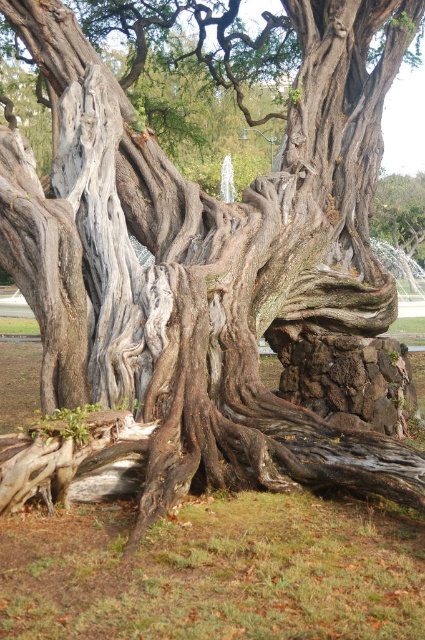
Based on the photo, you are standing in the park and want to place a small statue exactly at the coordinates where the gray rough bark tree root at center is located. What are the coordinates you should aim for?

The coordinates for the gray rough bark tree root at center are 0.719 on the x axis and 0.174 on the y axis.

You are standing in the park near the ancient tree and want to walk from the point at coordinates point (108, 488) to the fountain in the distance. Which direction should you head relative to the point at coordinates point (419, 230)?

Since point (108, 488) is in front of point (419, 230), you should head away from point (419, 230) to reach the fountain.